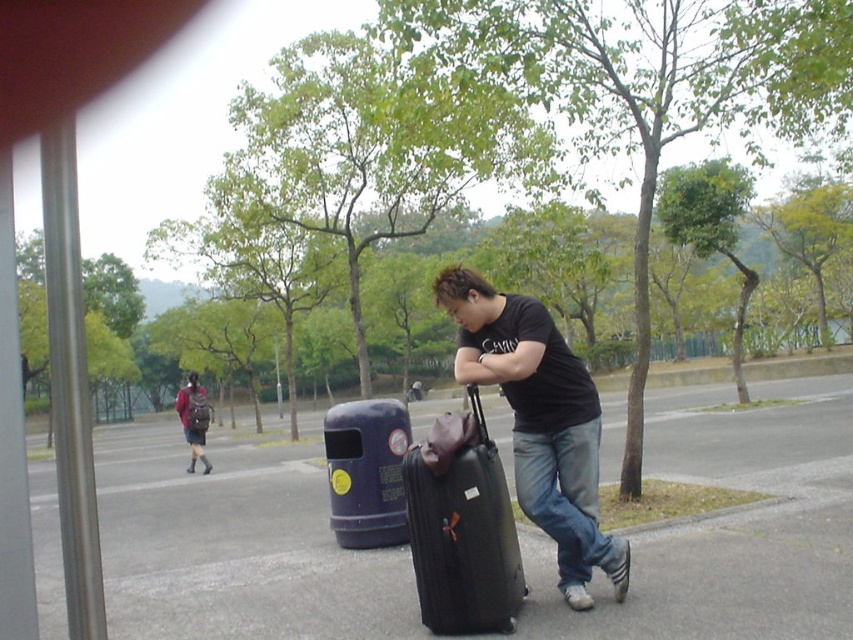
Question: Does black hard suitcase at center appear over leather suitcase at center?

Choices:
 (A) no
 (B) yes

Answer: (A)

Question: Does black matte suitcase at center appear on the right side of black hard suitcase at center?

Choices:
 (A) yes
 (B) no

Answer: (A)

Question: Which point appears closest to the camera in this image?

Choices:
 (A) (x=611, y=540)
 (B) (x=515, y=538)

Answer: (B)

Question: Is black hard suitcase at center closer to the viewer compared to leather suitcase at center?

Choices:
 (A) no
 (B) yes

Answer: (B)

Question: Based on their relative distances, which object is nearer to the leather suitcase at center?

Choices:
 (A) black matte suitcase at center
 (B) black hard suitcase at center

Answer: (B)

Question: Among these points, which one is farthest from the camera?

Choices:
 (A) (465, 282)
 (B) (415, 547)
 (C) (440, 420)

Answer: (C)